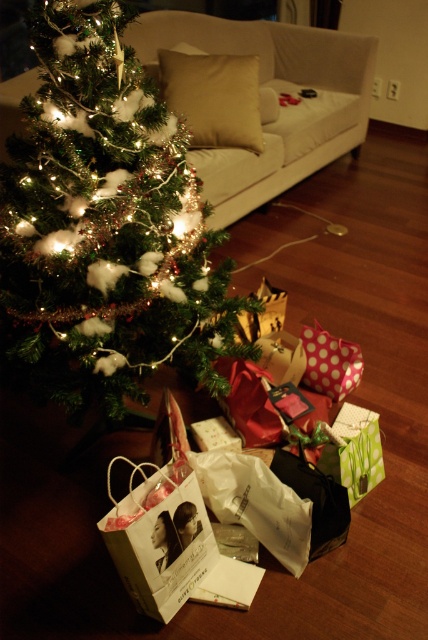
Question: Can you confirm if green matte christmas tree at left is positioned to the left of white paper gift bag at lower center?

Choices:
 (A) no
 (B) yes

Answer: (B)

Question: Can you confirm if green matte christmas tree at left is smaller than white paper gift bag at lower center?

Choices:
 (A) yes
 (B) no

Answer: (B)

Question: Which object is closer to the camera taking this photo?

Choices:
 (A) white paper gift bag at lower center
 (B) green matte christmas tree at left

Answer: (B)

Question: Which point appears farthest from the camera in this image?

Choices:
 (A) (166, 134)
 (B) (115, 564)

Answer: (B)

Question: Which of the following is the farthest from the observer?

Choices:
 (A) (169, 544)
 (B) (101, 362)

Answer: (B)

Question: From the image, what is the correct spatial relationship of green matte christmas tree at left in relation to white paper gift bag at lower center?

Choices:
 (A) below
 (B) above

Answer: (B)